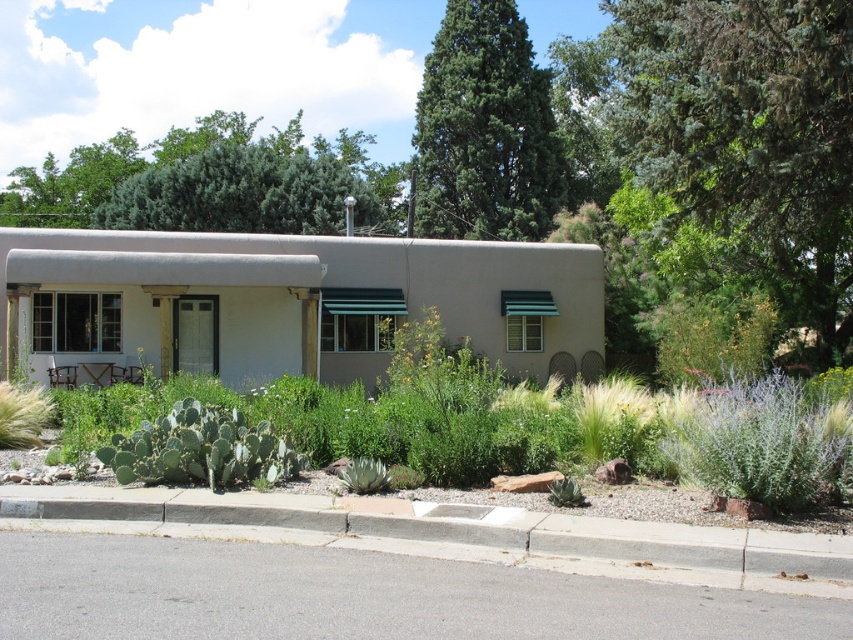
You are standing at the entrance of the building and want to walk to the gray concrete curb at lower center. What are the coordinates you should head towards?

The gray concrete curb at lower center is located at point (456, 536), so you should head towards those coordinates.